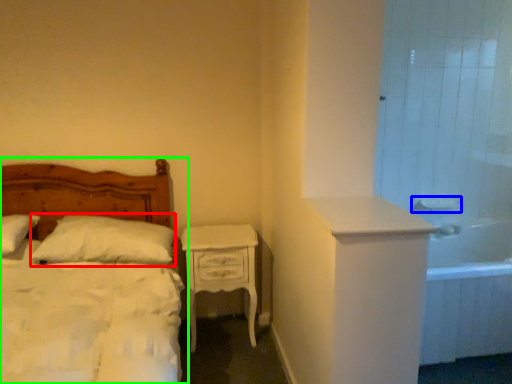
Question: Which object is positioned closest to pillow (highlighted by a red box)? Select from sink (highlighted by a blue box) and bed (highlighted by a green box).

Choices:
 (A) sink
 (B) bed

Answer: (B)